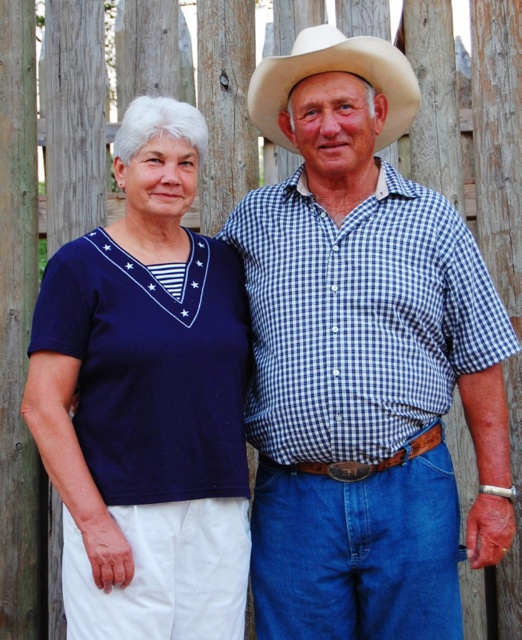
Question: Which of the following is the farthest from the observer?

Choices:
 (A) [x=238, y=387]
 (B) [x=384, y=598]
 (C) [x=404, y=61]

Answer: (C)

Question: Which object is farther from the camera taking this photo?

Choices:
 (A) blue checkered shirt at center
 (B) white felt cowboy hat at upper center

Answer: (B)

Question: Does blue checkered shirt at center appear on the right side of navy blue fabric shirt at left?

Choices:
 (A) yes
 (B) no

Answer: (A)

Question: Can you confirm if blue checkered shirt at center is bigger than navy blue fabric shirt at left?

Choices:
 (A) no
 (B) yes

Answer: (B)

Question: Is navy blue fabric shirt at left positioned at the back of white felt cowboy hat at upper center?

Choices:
 (A) no
 (B) yes

Answer: (A)

Question: Which point appears closest to the camera in this image?

Choices:
 (A) (388, 486)
 (B) (350, 61)
 (C) (77, 548)

Answer: (C)